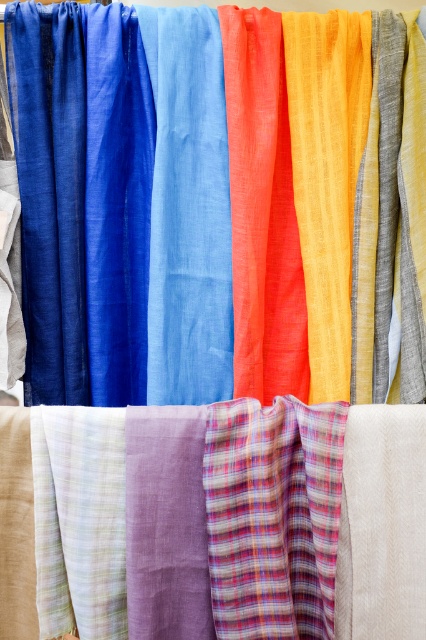
Question: Which point appears closest to the camera in this image?

Choices:
 (A) (32, 580)
 (B) (411, 16)

Answer: (A)

Question: Is plaid fabric at center below matte blue fabric at center?

Choices:
 (A) no
 (B) yes

Answer: (B)

Question: Is plaid fabric at center positioned at the back of matte blue fabric at center?

Choices:
 (A) no
 (B) yes

Answer: (A)

Question: Among these points, which one is nearest to the camera?

Choices:
 (A) (5, 472)
 (B) (367, 38)

Answer: (A)

Question: Does plaid fabric at center have a greater width compared to matte blue fabric at center?

Choices:
 (A) no
 (B) yes

Answer: (A)